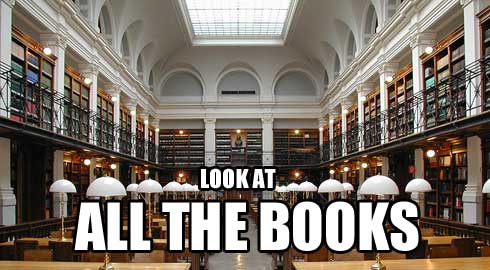
Locate an element on the screen. This screenshot has height=270, width=490. red books top level left side shelf is located at coordinates (33, 107), (17, 118).